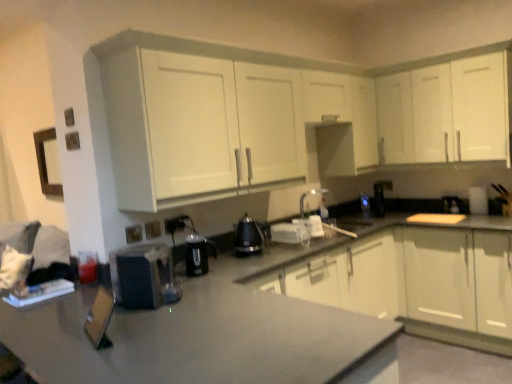
Question: From their relative heights in the image, would you say white glossy cabinet at upper right, positioned as the third cabinetry in bottom-to-top order, is taller or shorter than white glossy kettle at center, the 5th appliance when ordered from left to right?

Choices:
 (A) tall
 (B) short

Answer: (A)

Question: Do you think white glossy cabinet at upper right, positioned as the third cabinetry in bottom-to-top order, is within white glossy kettle at center, which is the second appliance from back to front, or outside of it?

Choices:
 (A) outside
 (B) inside

Answer: (A)

Question: Estimate the real-world distances between objects in this image. Which object is farther from the gray matte countertop at center?

Choices:
 (A) white glossy kettle at center, the 5th appliance when ordered from left to right
 (B) black plastic kettle at center, which ranks as the 3th appliance in right-to-left order
 (C) black plastic electric outlet at lower center, which is counted as the first electric outlet, starting from the back
 (D) matte plastic electric outlet at lower center, the 2th electric outlet viewed from the back
 (E) black plastic coffee maker at center, which is the 3th appliance from left to right

Answer: (D)

Question: Considering the real-world distances, which object is farthest from the white glossy cabinets at center, marked as the first cabinetry in a bottom-to-top arrangement?

Choices:
 (A) matte black electric outlet at lower left, positioned as the first electric outlet in left-to-right order
 (B) white glossy kettle at center, which is the second appliance from back to front
 (C) satin black coffee maker at right, the first appliance in the right-to-left sequence
 (D) white matte cabinet at upper center, positioned as the second cabinetry in top-to-bottom order
 (E) black plastic coffee maker at center, arranged as the third appliance when viewed from the front

Answer: (A)